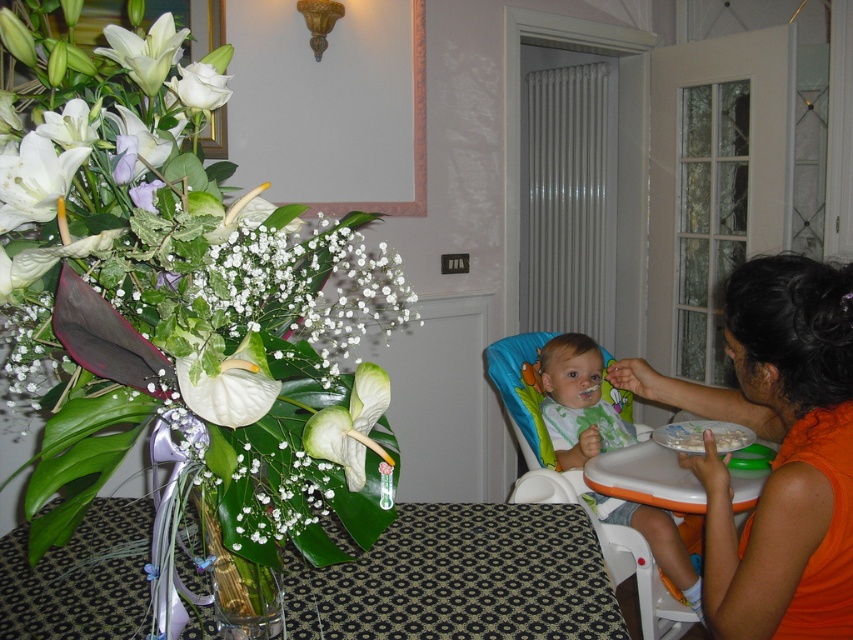
How much distance is there between matte green bib at center and clear glass vase at left?

4.43 feet

Can you confirm if matte green bib at center is thinner than clear glass vase at left?

No.

Between point (611, 413) and point (224, 586), which one is positioned in front?

Point (224, 586) is more forward.

The width and height of the screenshot is (853, 640). Identify the location of matte green bib at center. (577, 401).

Between orange fabric shirt at right and white matte rose at upper left, which one has more height?

With more height is orange fabric shirt at right.

Who is more distant from viewer, (808, 618) or (167, 84)?

The point (808, 618) is behind.

Where is `orange fabric shirt at right`? The width and height of the screenshot is (853, 640). orange fabric shirt at right is located at coordinates (778, 452).

Is white glossy flowers at left shorter than clear glass vase at left?

No, white glossy flowers at left is not shorter than clear glass vase at left.

Is white glossy flowers at left bigger than clear glass vase at left?

Yes.

Which is in front, point (38, 556) or point (263, 634)?

Point (38, 556) is in front.

The width and height of the screenshot is (853, 640). I want to click on white glossy flowers at left, so click(180, 317).